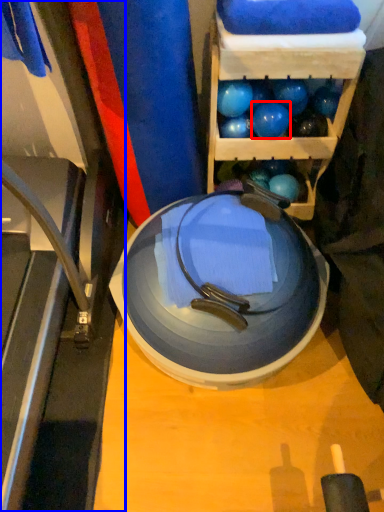
Question: Which point is further to the camera, ball (highlighted by a red box) or treadmill (highlighted by a blue box)?

Choices:
 (A) ball
 (B) treadmill

Answer: (A)